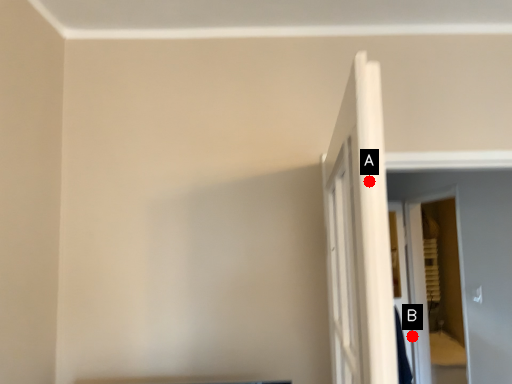
Question: Two points are circled on the image, labeled by A and B beside each circle. Among these points, which one is farthest from the camera?

Choices:
 (A) A is further
 (B) B is further

Answer: (B)